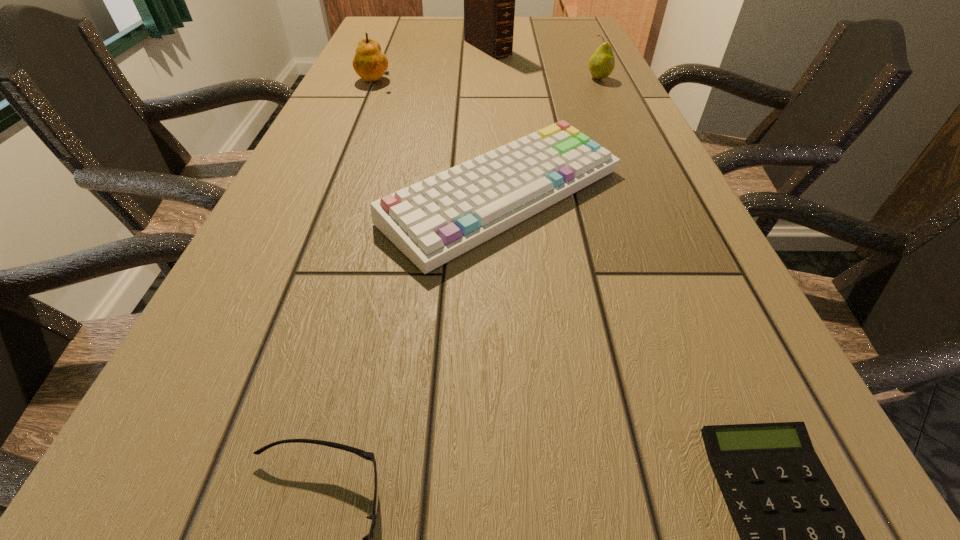
The height and width of the screenshot is (540, 960). Identify the location of the farthest object. (489, 0).

This screenshot has width=960, height=540. I want to click on Bible, so click(489, 0).

The width and height of the screenshot is (960, 540). Find the location of `the left pear`. the left pear is located at coordinates (370, 63).

This screenshot has width=960, height=540. I want to click on the right pear, so click(602, 62).

At what (x,y) coordinates should I click in order to perform the action: click on the fourth shortest object. Please return your answer as a coordinate pair (x, y). Looking at the image, I should click on (602, 62).

Locate an element on the screen. computer keyboard is located at coordinates coord(433,221).

The height and width of the screenshot is (540, 960). Find the location of `the third nearest object`. the third nearest object is located at coordinates (433, 221).

Identify the location of free space located on the back of the farthest object. (487, 20).

Locate an element on the screen. The height and width of the screenshot is (540, 960). vacant area located 0.070m on the front of the left pear is located at coordinates (367, 103).

Find the location of a particular element. blank space located 0.060m on the back of the fourth shortest object is located at coordinates (593, 65).